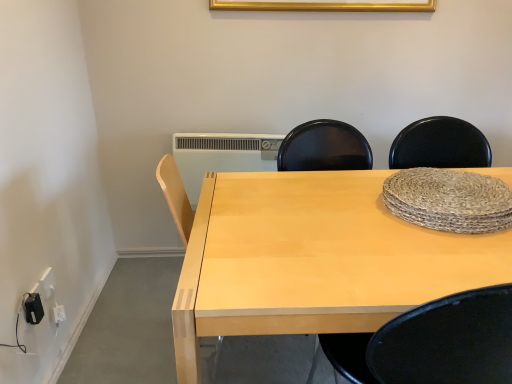
Question: Is black plastic electric outlet at lower left, which ranks as the 1th electric outlet in right-to-left order, aimed at gold metallic picture frame at upper center?

Choices:
 (A) yes
 (B) no

Answer: (B)

Question: Is black plastic electric outlet at lower left, which ranks as the 1th electric outlet in right-to-left order, next to gold metallic picture frame at upper center and touching it?

Choices:
 (A) yes
 (B) no

Answer: (B)

Question: From a real-world perspective, is black plastic electric outlet at lower left, the 2th electric outlet when ordered from back to front, located higher than gold metallic picture frame at upper center?

Choices:
 (A) yes
 (B) no

Answer: (B)

Question: Is black plastic electric outlet at lower left, positioned as the 2th electric outlet in left-to-right order, taller than gold metallic picture frame at upper center?

Choices:
 (A) no
 (B) yes

Answer: (B)

Question: From a real-world perspective, does black plastic electric outlet at lower left, positioned as the 2th electric outlet in left-to-right order, sit lower than gold metallic picture frame at upper center?

Choices:
 (A) yes
 (B) no

Answer: (A)

Question: Is black plastic electric outlet at lower left, positioned as the 2th electric outlet in left-to-right order, wider than gold metallic picture frame at upper center?

Choices:
 (A) yes
 (B) no

Answer: (B)

Question: Is white plastic radiator at center closer to camera compared to gold metallic picture frame at upper center?

Choices:
 (A) yes
 (B) no

Answer: (B)

Question: Is white plastic radiator at center further to the viewer compared to gold metallic picture frame at upper center?

Choices:
 (A) yes
 (B) no

Answer: (A)

Question: Is white plastic radiator at center thinner than gold metallic picture frame at upper center?

Choices:
 (A) no
 (B) yes

Answer: (A)

Question: Is white plastic radiator at center outside gold metallic picture frame at upper center?

Choices:
 (A) yes
 (B) no

Answer: (A)

Question: From the image's perspective, does white plastic radiator at center appear lower than gold metallic picture frame at upper center?

Choices:
 (A) no
 (B) yes

Answer: (B)

Question: Is white plastic radiator at center taller than gold metallic picture frame at upper center?

Choices:
 (A) yes
 (B) no

Answer: (A)

Question: Is gold metallic picture frame at upper center at the right side of white plastic radiator at center?

Choices:
 (A) no
 (B) yes

Answer: (B)